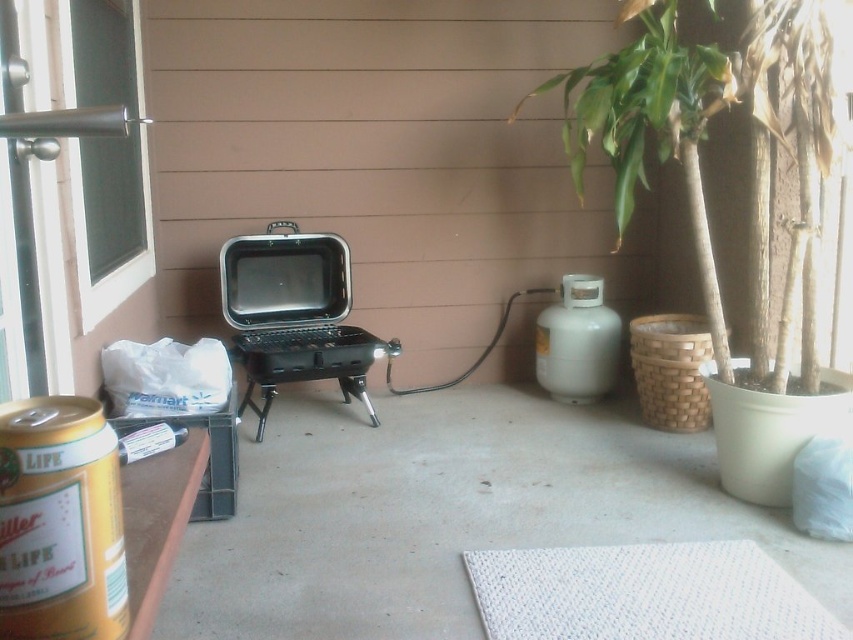
Between point (288, 246) and point (102, 147), which one is positioned in front?

Point (102, 147) is more forward.

Does black matte barbecue grill at center appear under clear glass screen door at upper left?

Yes, black matte barbecue grill at center is below clear glass screen door at upper left.

Locate an element on the screen. black matte barbecue grill at center is located at coordinates (294, 314).

The image size is (853, 640). In order to click on black matte barbecue grill at center in this screenshot , I will do `click(294, 314)`.